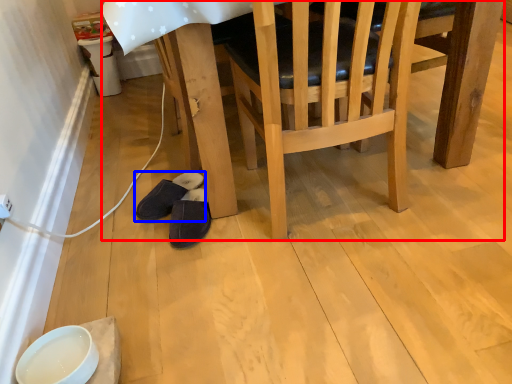
Question: Which object is closer to the camera taking this photo, table (highlighted by a red box) or footwear (highlighted by a blue box)?

Choices:
 (A) table
 (B) footwear

Answer: (A)